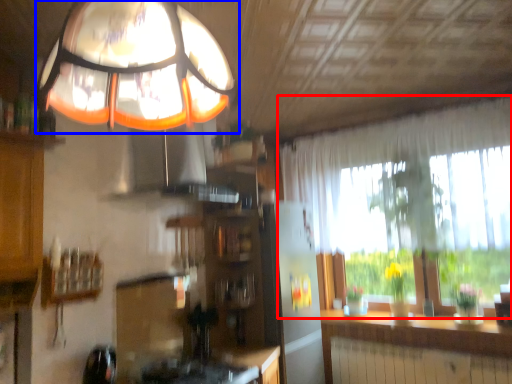
Question: Which point is further to the camera, window (highlighted by a red box) or lamp (highlighted by a blue box)?

Choices:
 (A) window
 (B) lamp

Answer: (A)